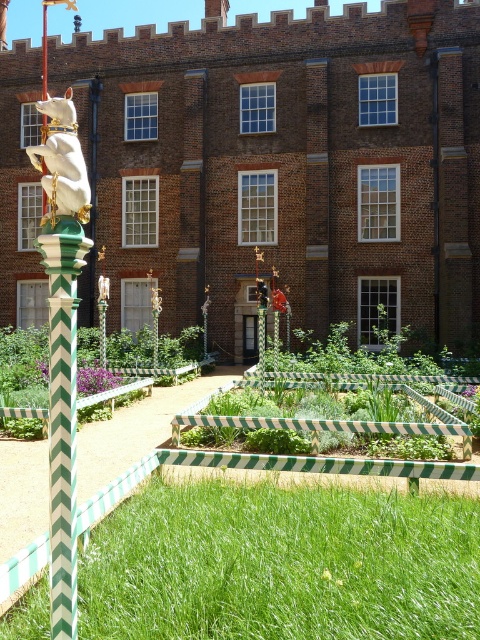
You are a gardener who wants to place a new small potted plant in the garden. The potted plant is 1 foot tall. You have two options for placement next to either the green striped planter at center or the white glossy statue at left. Which location would allow the potted plant to be more visible to visitors walking by?

The white glossy statue at left is taller than the green striped planter at center. Placing the potted plant next to the white glossy statue at left would make it more visible since the statue provides a taller base, lifting the potted plant higher and making it stand out more to visitors.

You are a gardener who wants to water the white glossy statue at left and the green striped planter at center. You have a hose that can reach 2 meters. The statue is behind the planter. If you stand in front of the planter, can you reach the statue with the hose?

The white glossy statue at left is behind the green striped planter at center. Since the statue is behind the planter, the hose may be obstructed by the planter, making it difficult to reach the statue from the front. Consider moving around the planter to access the statue.